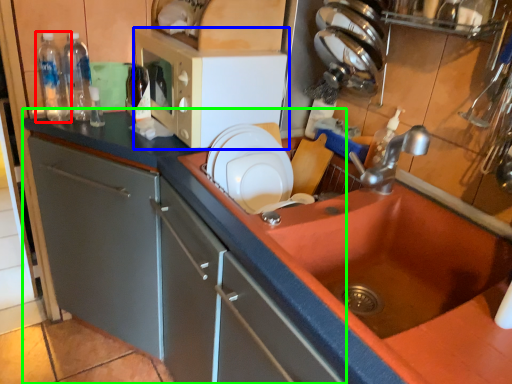
Question: Estimate the real-world distances between objects in this image. Which object is closer to bottle (highlighted by a red box), microwave oven (highlighted by a blue box) or countertop (highlighted by a green box)?

Choices:
 (A) microwave oven
 (B) countertop

Answer: (A)